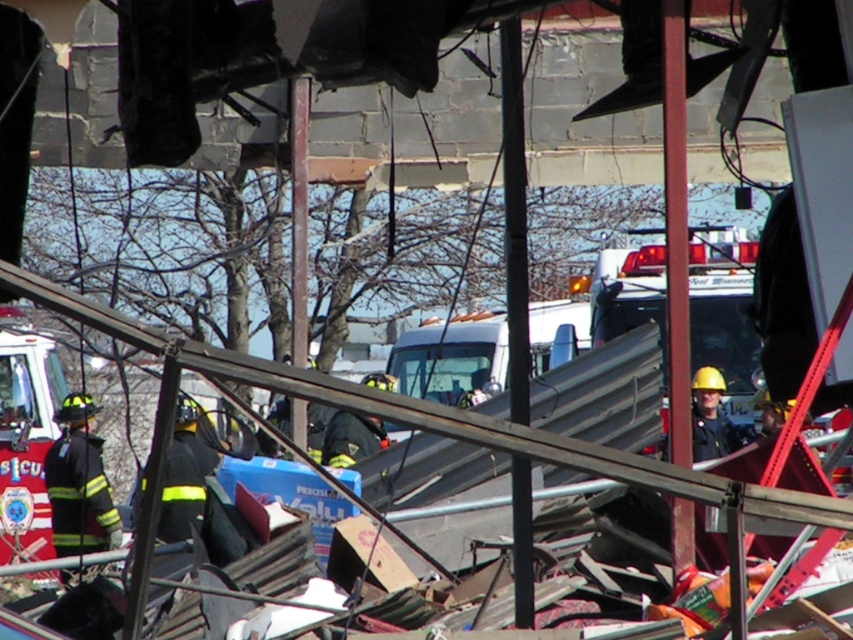
You are a photographer at the disaster site. You have a camera with a 100mm lens that can capture objects up to 2 meters wide. You need to take a photo of both the red glossy fire truck at lower left and the black uniformed firefighter at left. Can you fit both into the frame without zooming out?

The red glossy fire truck at lower left is wider than the black uniformed firefighter at left. Since the fire truck is wider and the camera can capture up to 2 meters, you need to ensure their combined width doesn

You are a journalist at the scene of the collapsed structure. You need to describe the positions of the red glossy fire truck at lower left and the black uniformed firefighter at left in your report. According to the image, which object is positioned to the left of the other?

The red glossy fire truck at lower left is positioned to the left of the black uniformed firefighter at left.

You are a drone operator trying to get a clear aerial view of the disaster area. You notice the red glossy fire truck at lower left and the black uniformed firefighter at left. Which object is closer to the drone camera? Please explain using their positions.

The red glossy fire truck at lower left is closer to the drone camera because the black uniformed firefighter at left is behind it.